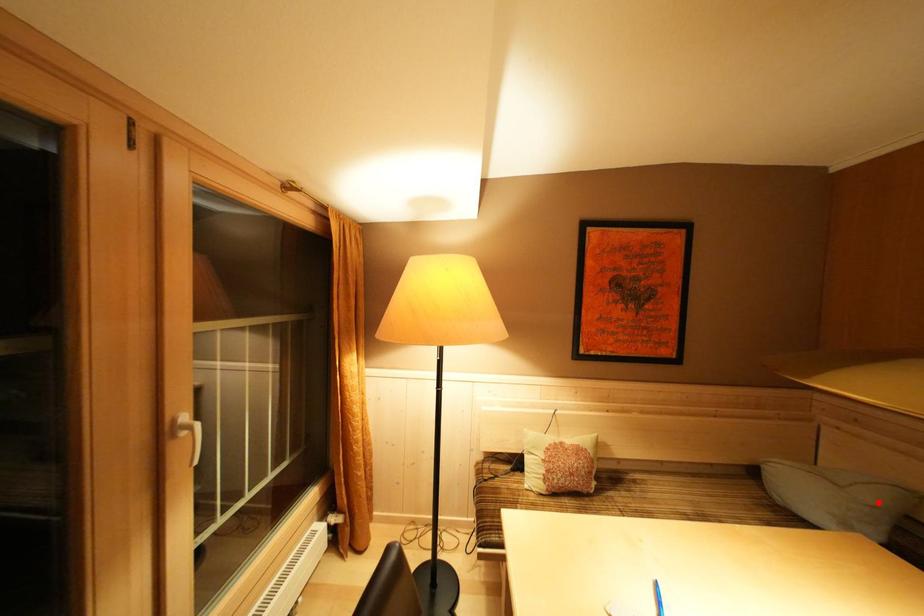
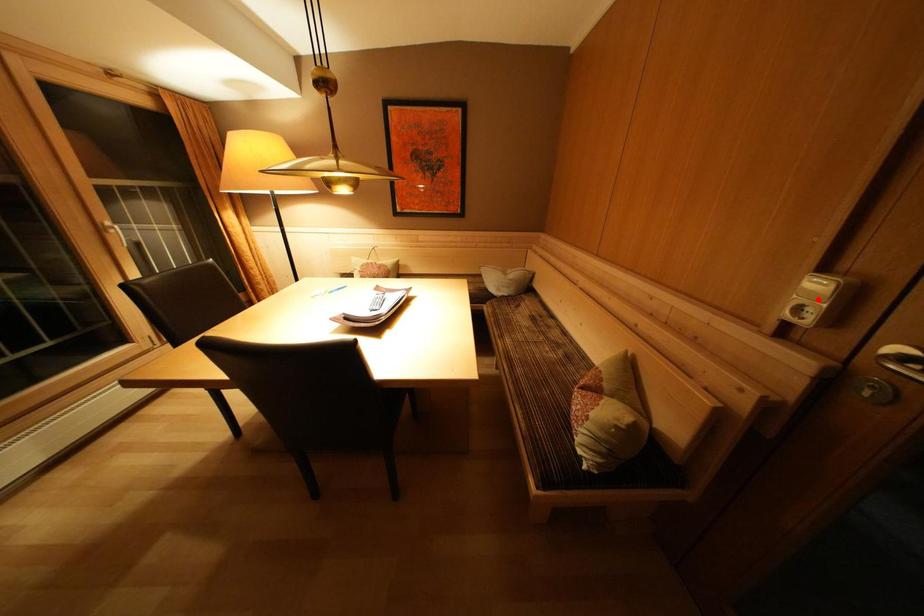
I am providing you with two images of the same scene from different viewpoints. A red point is marked on the first image and another point is marked on the second image. Does the point marked in image1 correspond to the same location as the one in image2?

No